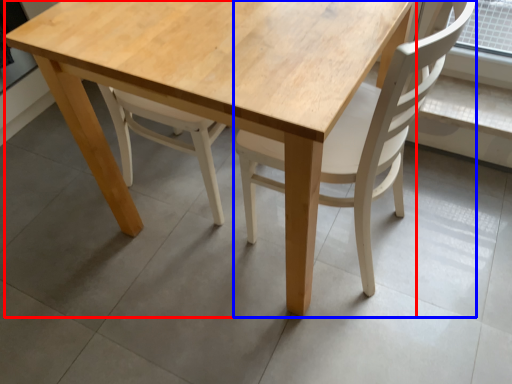
Question: Which of the following is the farthest to the observer, round table (highlighted by a red box) or chair (highlighted by a blue box)?

Choices:
 (A) round table
 (B) chair

Answer: (A)